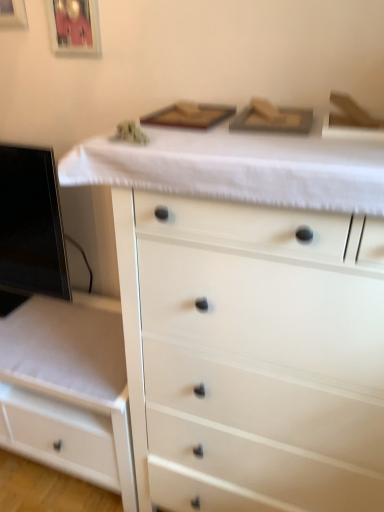
Find the location of `vacant space to the right of black glossy computer monitor at left`. vacant space to the right of black glossy computer monitor at left is located at coordinates (91, 318).